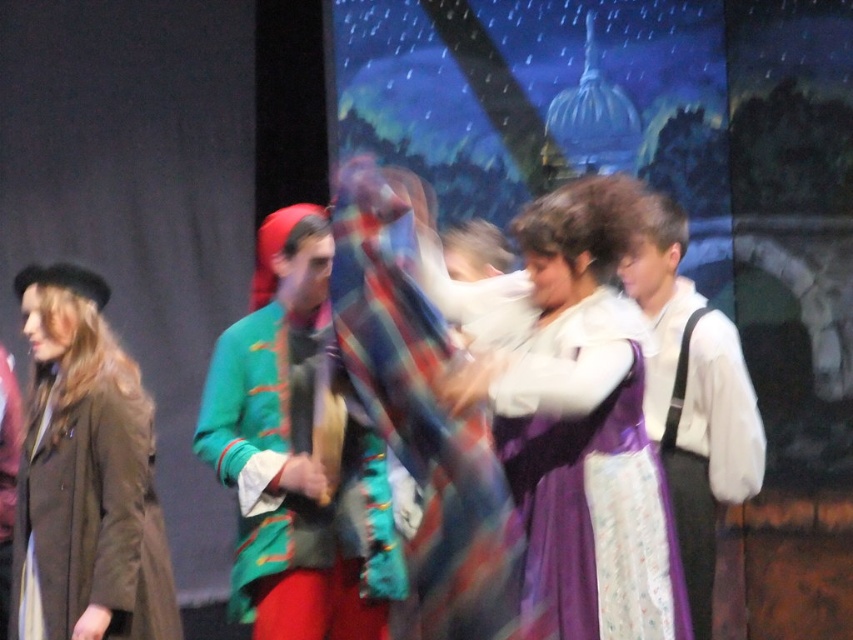
Question: Which object appears farthest from the camera in this image?

Choices:
 (A) green velvet jacket at center
 (B) matte purple dress at center

Answer: (A)

Question: Is green velvet jacket at center closer to the viewer compared to matte brown coat at left?

Choices:
 (A) no
 (B) yes

Answer: (A)

Question: Which is nearer to the matte purple dress at center?

Choices:
 (A) white cotton shirt at right
 (B) matte brown coat at left
 (C) green velvet jacket at center

Answer: (A)

Question: Among these points, which one is farthest from the camera?

Choices:
 (A) (280, 600)
 (B) (57, 500)
 (C) (688, 502)
 (D) (538, 385)

Answer: (C)

Question: Is matte purple dress at center below green velvet jacket at center?

Choices:
 (A) no
 (B) yes

Answer: (A)

Question: Is matte purple dress at center to the right of matte brown coat at left from the viewer's perspective?

Choices:
 (A) yes
 (B) no

Answer: (A)